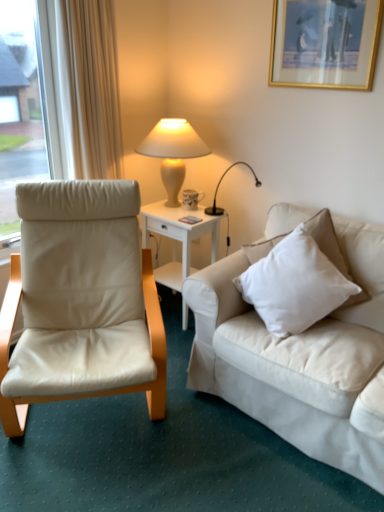
You are a GUI agent. You are given a task and a screenshot of the screen. Output one action in this format:
    pyautogui.click(x=<x>, y=<y>)
    Task: Click on the vacant space situated above white glossy side table at center (from a real-world perspective)
    Image resolution: width=384 pixels, height=512 pixels.
    Given the screenshot: What is the action you would take?
    click(175, 209)